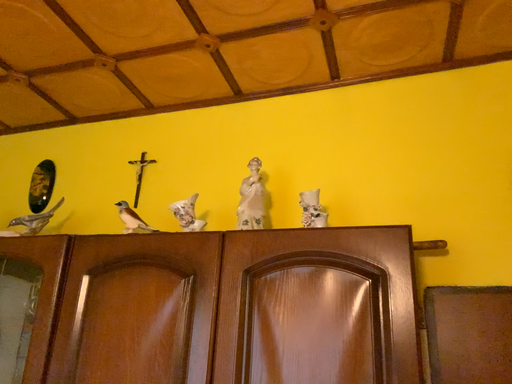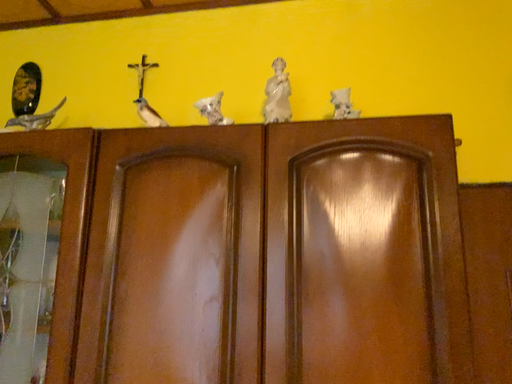
Question: Which way did the camera rotate in the video?

Choices:
 (A) rotated downward
 (B) rotated upward

Answer: (A)